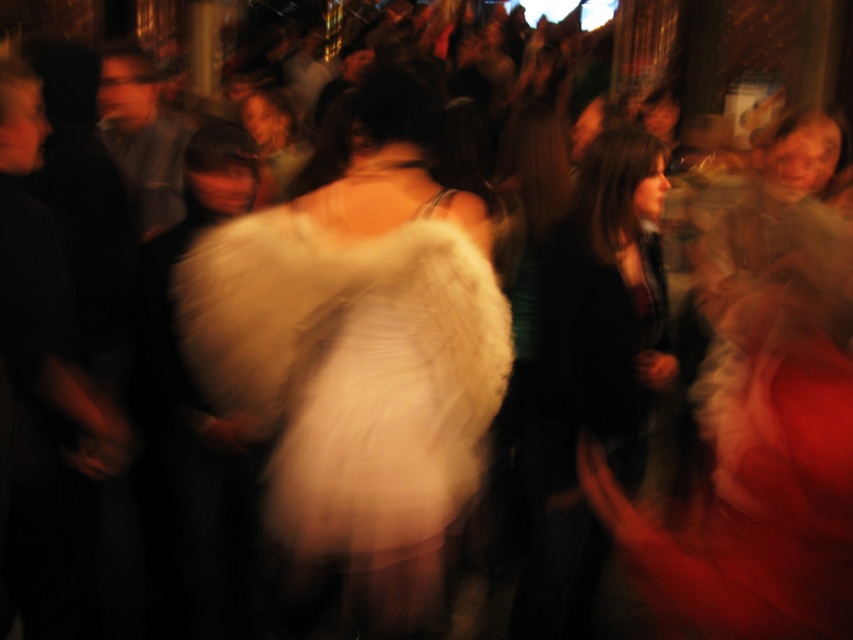
You are at a party and want to take a closer look at the white fluffy dress at center and the dark green fabric jacket at center. Which one would you need to walk towards first to get a better view?

The white fluffy dress at center is closer to the viewer than the dark green fabric jacket at center, so you should walk towards the white fluffy dress at center first to get a better view.

In the lively social gathering scene, there is a white fluffy dress at center and a dark green fabric jacket at center. Which object is shorter?

The white fluffy dress at center is shorter than the dark green fabric jacket at center.